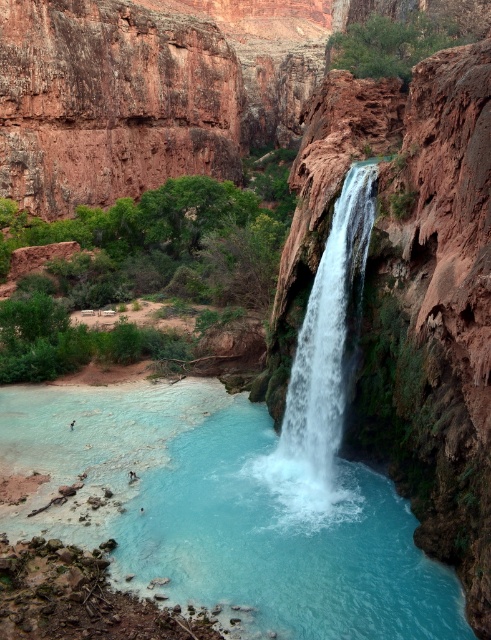
You are standing at the edge of the canyon looking at the waterfall. You notice two types of water in the pool below. Which one is closer to you, the clear blue water at center or the white frothy water at center?

The clear blue water at center is closer to the viewer than the white frothy water at center.

You are standing at the edge of the canyon and notice two types of water in the pool below. The clear blue water at center and the white frothy water at center. Which one is lower in height compared to the other?

The clear blue water at center is not as tall as the white frothy water at center, so the clear blue water at center is lower in height compared to the white frothy water at center.